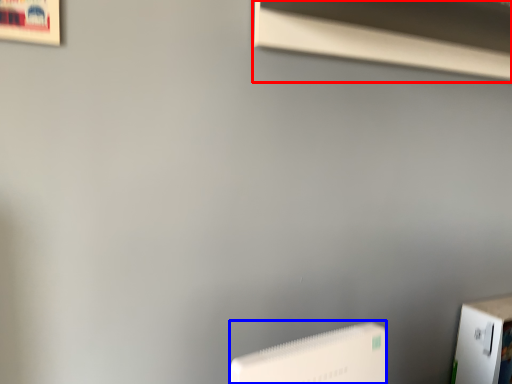
Question: Which point is closer to the camera, window sill (highlighted by a red box) or Wii (highlighted by a blue box)?

Choices:
 (A) window sill
 (B) Wii

Answer: (B)